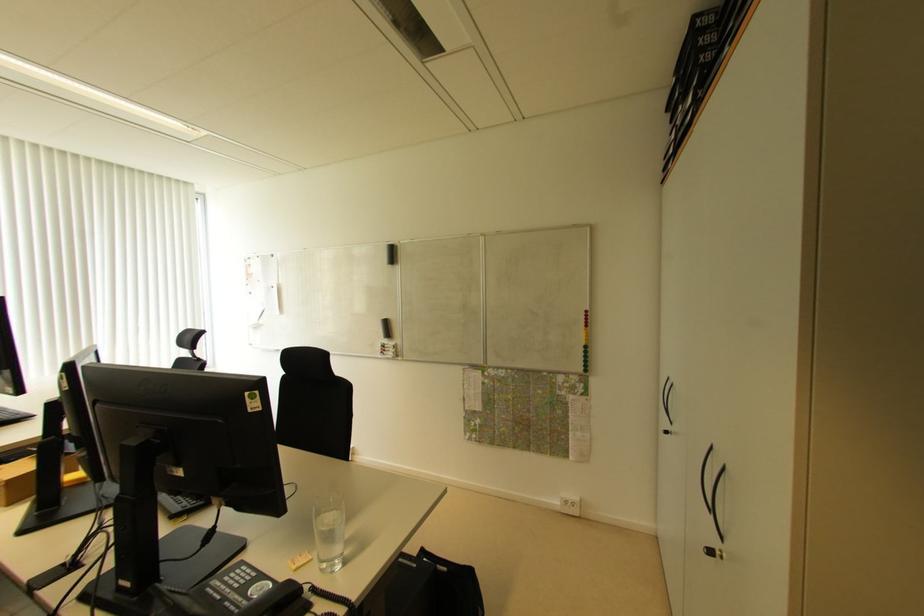
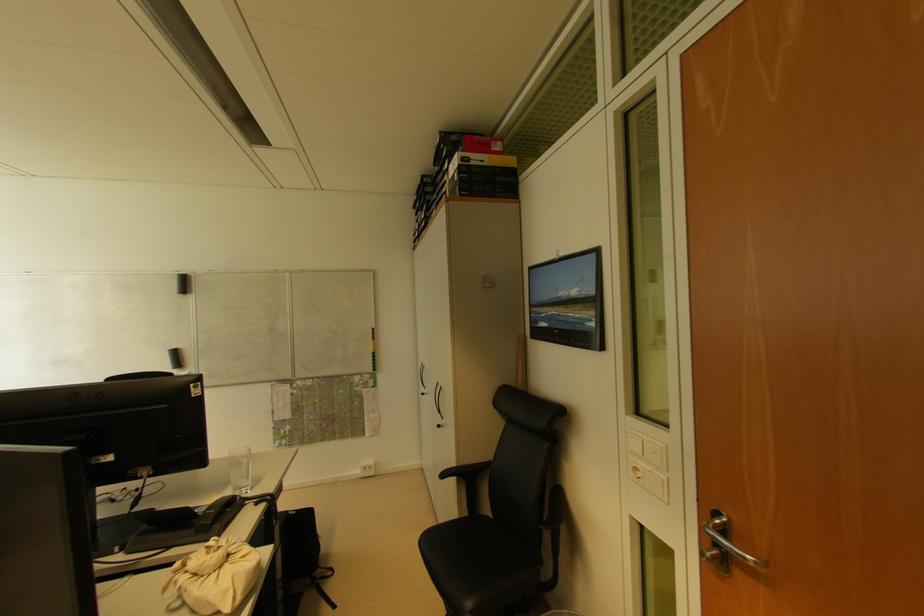
The point at (395, 257) is marked in the first image. Where is the corresponding point in the second image?

(187, 286)